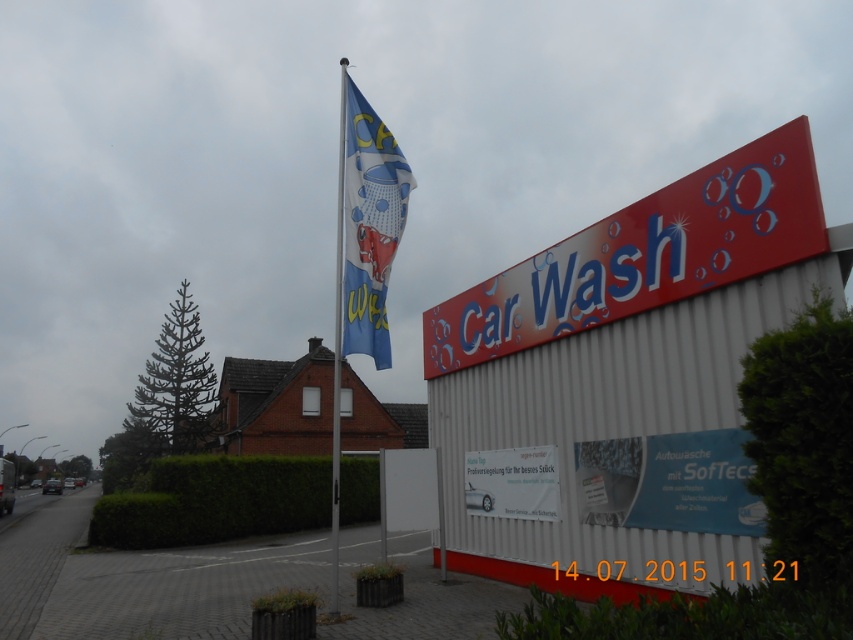
Question: Which point is closer to the camera?

Choices:
 (A) blue fabric flag pole at upper center
 (B) red corrugated metal car wash at upper right
 (C) white glossy sign at center

Answer: (A)

Question: Estimate the real-world distances between objects in this image. Which object is closer to the metallic silver car at lower left?

Choices:
 (A) blue fabric flag at center
 (B) red matte sign at upper right
 (C) white glossy sign at center

Answer: (B)

Question: Is red corrugated metal car wash at upper right positioned behind blue fabric flag at center?

Choices:
 (A) yes
 (B) no

Answer: (A)

Question: Estimate the real-world distances between objects in this image. Which object is closer to the blue fabric flag pole at upper center?

Choices:
 (A) red matte sign at upper right
 (B) blue glossy signboard at center
 (C) white glossy sign at center
 (D) blue fabric flag at center

Answer: (C)

Question: Is red matte sign at upper right positioned in front of metallic silver car at lower left?

Choices:
 (A) yes
 (B) no

Answer: (A)

Question: Can you confirm if blue glossy signboard at center is thinner than blue fabric flag pole at upper center?

Choices:
 (A) no
 (B) yes

Answer: (B)